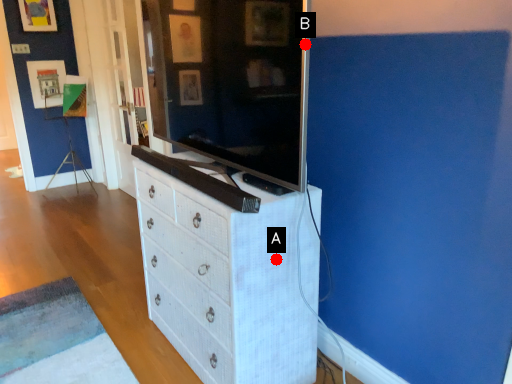
Question: Two points are circled on the image, labeled by A and B beside each circle. Among these points, which one is nearest to the camera?

Choices:
 (A) A is closer
 (B) B is closer

Answer: (B)